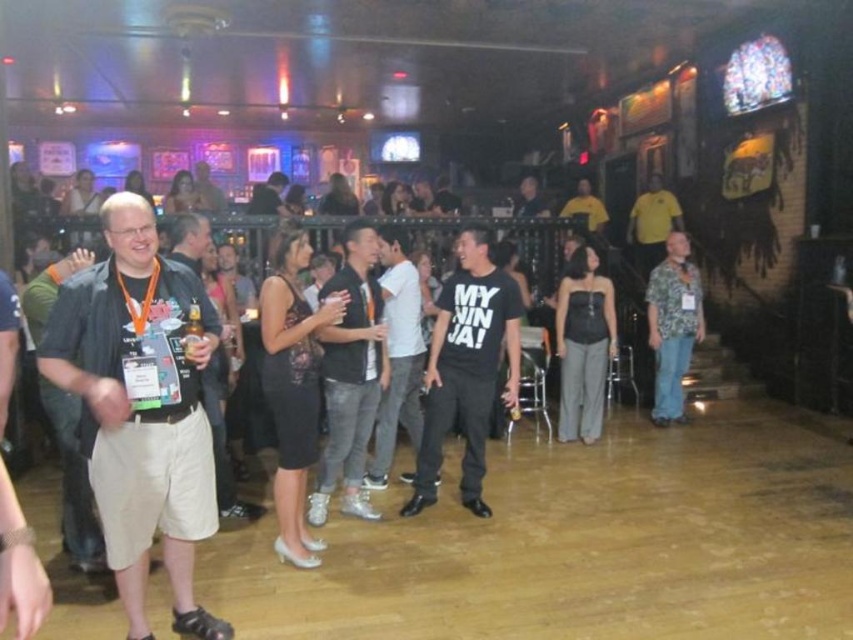
You are at the bar and want to order a drink. You see the dark gray shirt at left and the white matte shirt at center. Which person is closer to you?

The dark gray shirt at left is positioned under the white matte shirt at center, so the dark gray shirt at left is closer to you.

From the picture: You are a photographer at the event and need to capture both the dark gray shirt at left and the yellow cotton shirt at upper right in a single frame. Which person should you position closer to the camera to ensure both fit in the frame?

You should position the dark gray shirt at left closer to the camera because it is wider than the yellow cotton shirt at upper right, making it easier to include both in the frame without cropping.

You are at a party and want to find someone to dance with. You see the dark gray shirt at left and the black matte shirt at center. Which person is taller?

The dark gray shirt at left is taller than the black matte shirt at center.